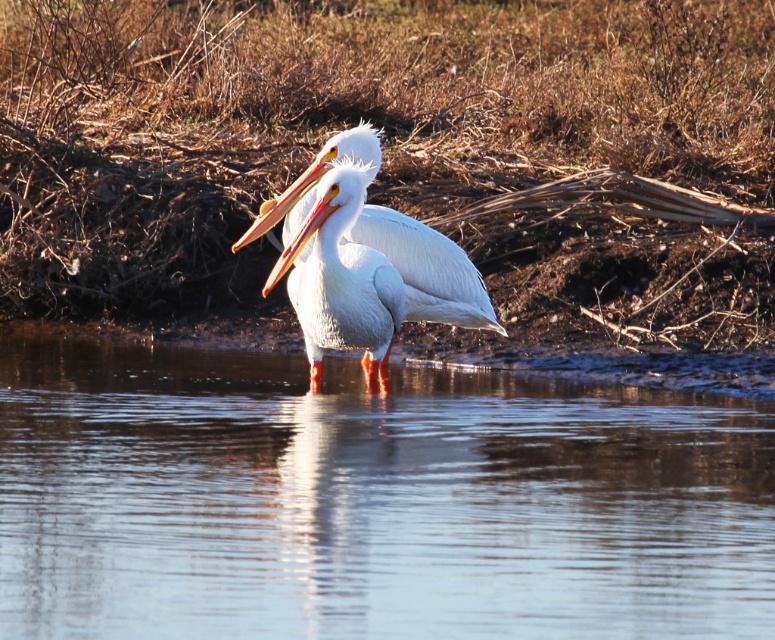
Question: Does white glossy beak at center have a greater width compared to matte orange beak at center?

Choices:
 (A) no
 (B) yes

Answer: (B)

Question: Which point is closer to the camera taking this photo?

Choices:
 (A) (236, 513)
 (B) (346, 152)

Answer: (A)

Question: Which is farther from the matte orange beak at center?

Choices:
 (A) white smooth pelican at center
 (B) clear water at center

Answer: (B)

Question: Is clear water at center to the right of white smooth pelican at center from the viewer's perspective?

Choices:
 (A) yes
 (B) no

Answer: (B)

Question: Which is farther from the clear water at center?

Choices:
 (A) white smooth pelican at center
 (B) matte orange beak at center

Answer: (B)

Question: Is clear water at center to the right of white smooth pelican at center from the viewer's perspective?

Choices:
 (A) yes
 (B) no

Answer: (B)